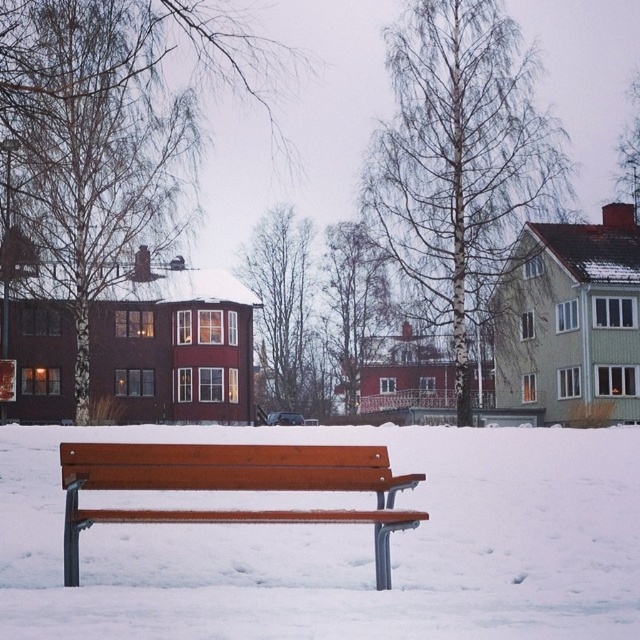
Between white matte bench at center and wooden bench at center, which one is positioned lower?

white matte bench at center

Is white matte bench at center positioned behind wooden bench at center?

That is False.

Between point (148, 499) and point (234, 483), which one is positioned in front?

Positioned in front is point (234, 483).

At what (x,y) coordinates should I click in order to perform the action: click on white matte bench at center. Please return your answer as a coordinate pair (x, y). This screenshot has width=640, height=640. Looking at the image, I should click on (344, 545).